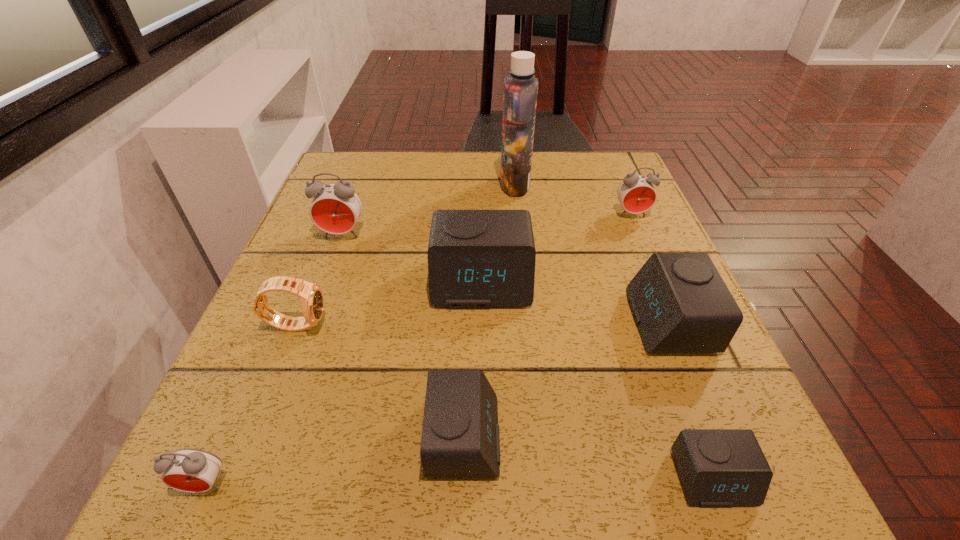
Identify the location of vacant area that lies between the smallest red alarm clock and the watch. (252, 404).

Image resolution: width=960 pixels, height=540 pixels. In order to click on free spot between the third biggest black alarm clock and the biggest black alarm clock in this screenshot , I will do `click(472, 359)`.

This screenshot has width=960, height=540. What are the coordinates of `vacant region between the biggest black alarm clock and the third biggest black alarm clock` in the screenshot? It's located at (472, 359).

Locate an element on the screen. This screenshot has width=960, height=540. free space between the shortest object and the third biggest black alarm clock is located at coordinates (588, 457).

Identify the location of vacant area that lies between the shortest alarm clock and the second farthest red alarm clock. (528, 356).

Where is `object identified as the fifth closest to the shampoo`? The height and width of the screenshot is (540, 960). object identified as the fifth closest to the shampoo is located at coordinates (311, 296).

Identify which object is the closest to the third biggest black alarm clock. Please provide its 2D coordinates. Your answer should be formatted as a tuple, i.e. [(x, y)], where the tuple contains the x and y coordinates of a point satisfying the conditions above.

[(476, 258)]

Where is `alarm clock identified as the third closest to the third biggest black alarm clock`? This screenshot has height=540, width=960. alarm clock identified as the third closest to the third biggest black alarm clock is located at coordinates (191, 470).

At what (x,y) coordinates should I click in order to perform the action: click on alarm clock that stands as the seventh closest to the black watch. Please return your answer as a coordinate pair (x, y). Image resolution: width=960 pixels, height=540 pixels. Looking at the image, I should click on (636, 193).

Choose which red alarm clock is the third nearest neighbor to the biggest black alarm clock. Please provide its 2D coordinates. Your answer should be formatted as a tuple, i.e. [(x, y)], where the tuple contains the x and y coordinates of a point satisfying the conditions above.

[(191, 470)]